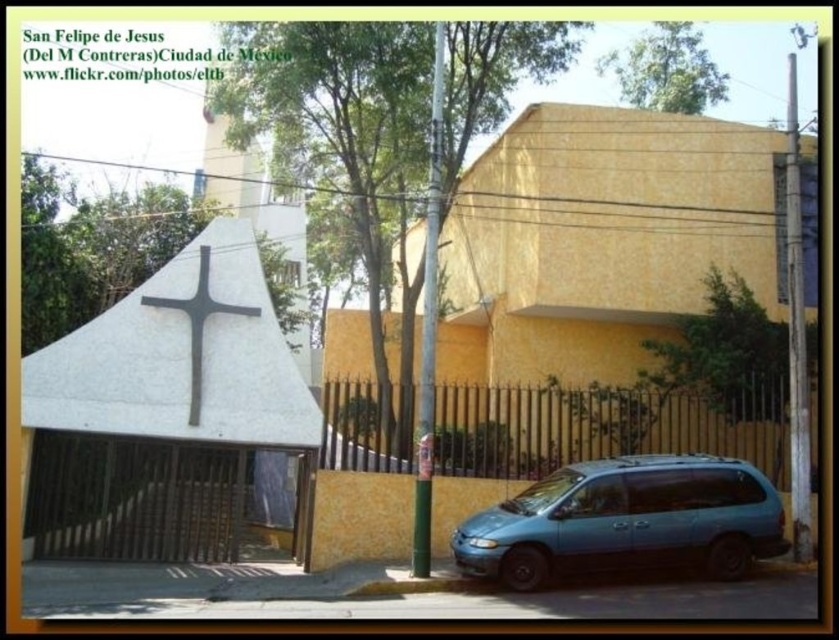
Question: Which object is the farthest from the teal matte minivan at lower right?

Choices:
 (A) white stone cross at center
 (B) yellow stucco chapel at center
 (C) white concrete cross at center

Answer: (A)

Question: Can you confirm if yellow stucco chapel at center is thinner than white stone cross at center?

Choices:
 (A) yes
 (B) no

Answer: (B)

Question: Is white concrete cross at center bigger than white stone cross at center?

Choices:
 (A) yes
 (B) no

Answer: (A)

Question: Which of these objects is positioned farthest from the yellow stucco chapel at center?

Choices:
 (A) teal matte minivan at lower right
 (B) white concrete cross at center

Answer: (B)

Question: Which point is farther to the camera?

Choices:
 (A) teal matte minivan at lower right
 (B) white concrete cross at center

Answer: (B)

Question: From the image, what is the correct spatial relationship of teal matte minivan at lower right in relation to white stone cross at center?

Choices:
 (A) above
 (B) below

Answer: (B)